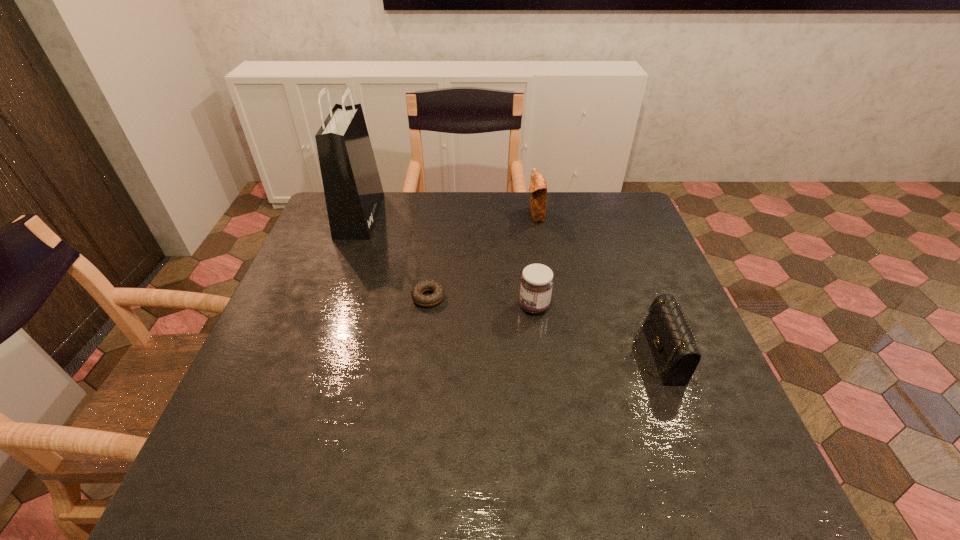
You are a GUI agent. You are given a task and a screenshot of the screen. Output one action in this format:
    pyautogui.click(x=<x>, y=<y>)
    Task: Click on the vacant space located on the open side of the second tallest object
    This screenshot has height=540, width=960.
    Given the screenshot: What is the action you would take?
    pyautogui.click(x=471, y=215)

The image size is (960, 540). Find the location of `vacant point located on the open side of the second tallest object`. vacant point located on the open side of the second tallest object is located at coordinates (462, 215).

This screenshot has height=540, width=960. Identify the location of vacant space located on the open side of the second tallest object. (492, 215).

Find the location of `vacant space located 0.190m on the front label of the jam`. vacant space located 0.190m on the front label of the jam is located at coordinates (444, 306).

The image size is (960, 540). I want to click on free point located on the front label of the jam, so click(x=436, y=306).

At what (x,y) coordinates should I click in order to perform the action: click on vacant space located 0.280m on the front label of the jam. Please return your answer as a coordinate pair (x, y). This screenshot has height=540, width=960. Looking at the image, I should click on (408, 306).

I want to click on vacant region located on the front flap of the rightmost object, so click(543, 354).

Image resolution: width=960 pixels, height=540 pixels. Find the location of `free space located on the front flap of the rightmost object`. free space located on the front flap of the rightmost object is located at coordinates (591, 354).

Where is `vacant space located 0.340m on the front flap of the rightmost object`? The width and height of the screenshot is (960, 540). vacant space located 0.340m on the front flap of the rightmost object is located at coordinates (486, 354).

Find the location of a particular element. The image size is (960, 540). free location located 0.380m on the right of the shortest object is located at coordinates (592, 298).